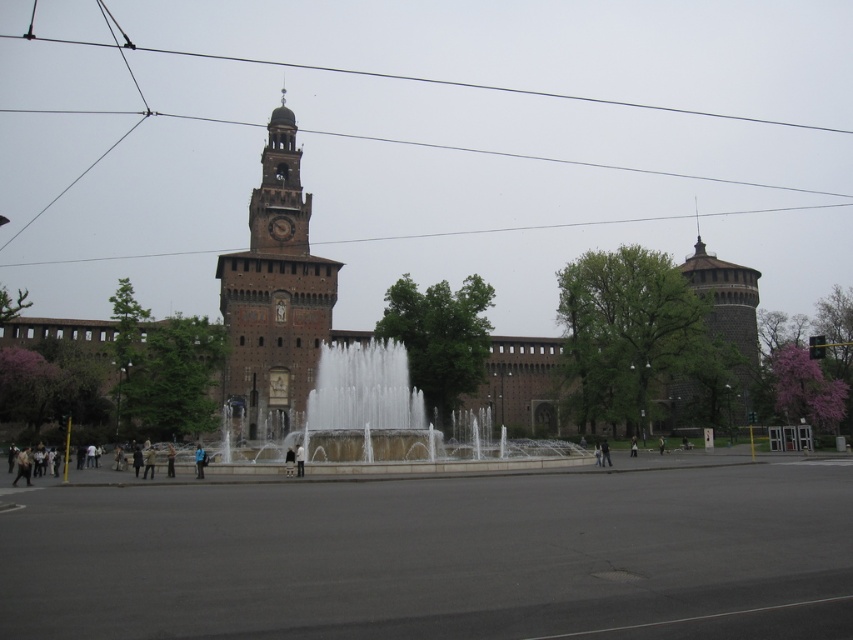
Question: Is brown stone clock tower at upper left above dark brown stone tower at upper right?

Choices:
 (A) no
 (B) yes

Answer: (B)

Question: Among these points, which one is nearest to the camera?

Choices:
 (A) [15, 35]
 (B) [277, 333]
 (C) [691, 276]
 (D) [320, 424]

Answer: (D)

Question: Is white stone fountain at center above dark brown stone tower at upper right?

Choices:
 (A) yes
 (B) no

Answer: (B)

Question: Which of these objects is positioned farthest from the brown stone clock tower at upper left?

Choices:
 (A) white stone fountain at center
 (B) dark brown stone tower at upper right

Answer: (B)

Question: Among these objects, which one is farthest from the camera?

Choices:
 (A) metallic wire at upper center
 (B) brown stone clock tower at upper left

Answer: (A)

Question: Does brown stone clock tower at upper left appear under metallic wire at upper center?

Choices:
 (A) yes
 (B) no

Answer: (A)